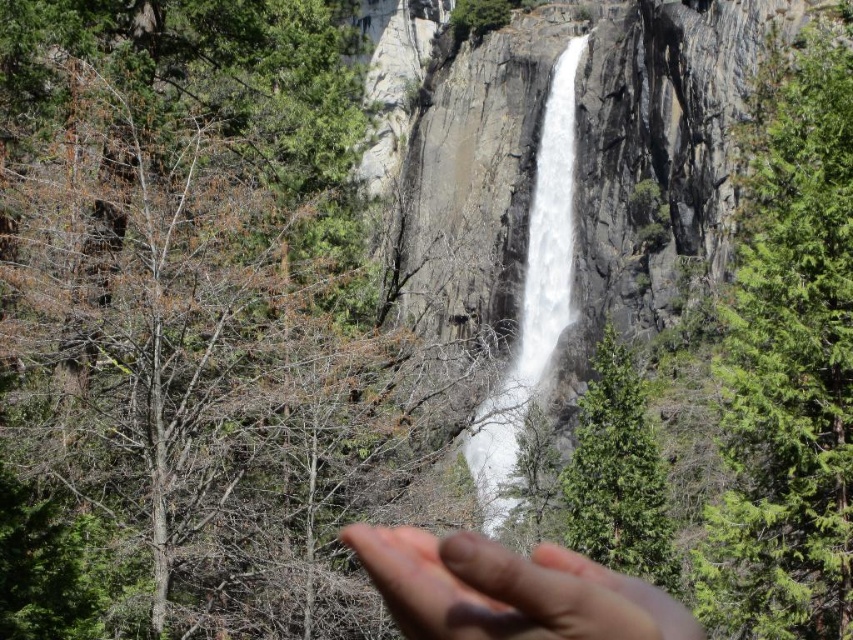
Question: Observing the image, what is the correct spatial positioning of skinny flesh at center in reference to white frothy water at center?

Choices:
 (A) left
 (B) right

Answer: (A)

Question: Does skinny flesh at center have a smaller size compared to white frothy water at center?

Choices:
 (A) no
 (B) yes

Answer: (B)

Question: In this image, where is skinny flesh at center located relative to white frothy water at center?

Choices:
 (A) below
 (B) above

Answer: (A)